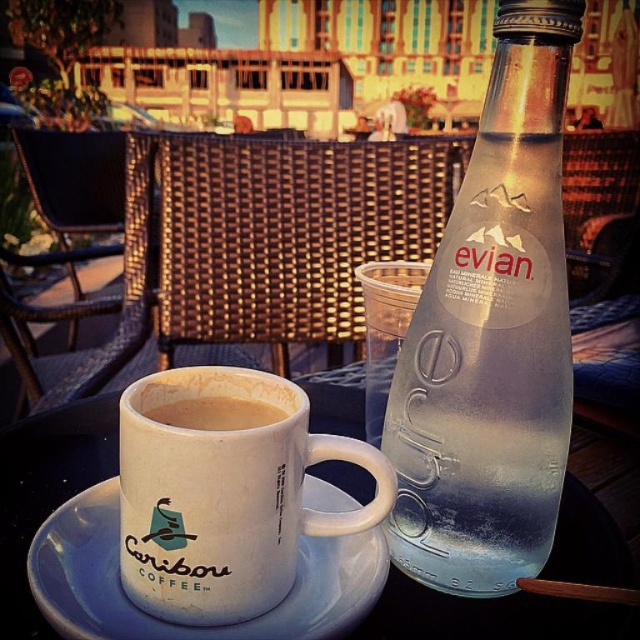
Question: Which point is closer to the camera taking this photo?

Choices:
 (A) (316, 525)
 (B) (602, 579)
 (C) (332, 580)

Answer: (A)

Question: Can you confirm if white matte mug at center is thinner than white ceramic cup at center?

Choices:
 (A) yes
 (B) no

Answer: (A)

Question: Which point is closer to the camera?

Choices:
 (A) white matte mug at center
 (B) white ceramic saucer at center

Answer: (B)

Question: Does white matte mug at center appear on the right side of white ceramic saucer at center?

Choices:
 (A) no
 (B) yes

Answer: (B)

Question: Is white ceramic saucer at center above brown matte coffee cup at center?

Choices:
 (A) no
 (B) yes

Answer: (A)

Question: Which point appears closest to the camera in this image?

Choices:
 (A) (536, 100)
 (B) (170, 460)
 (C) (179, 628)

Answer: (B)